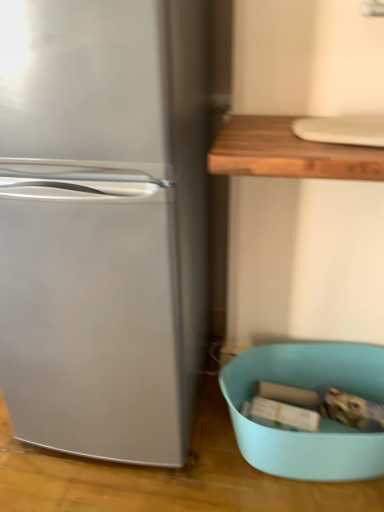
Question: Can you confirm if satin silver refrigerator at left is shorter than teal plastic bowl at lower right?

Choices:
 (A) yes
 (B) no

Answer: (B)

Question: From the image's perspective, is satin silver refrigerator at left below teal plastic bowl at lower right?

Choices:
 (A) no
 (B) yes

Answer: (A)

Question: Is satin silver refrigerator at left positioned far away from teal plastic bowl at lower right?

Choices:
 (A) no
 (B) yes

Answer: (A)

Question: Can you confirm if satin silver refrigerator at left is bigger than teal plastic bowl at lower right?

Choices:
 (A) yes
 (B) no

Answer: (A)

Question: Is satin silver refrigerator at left oriented away from teal plastic bowl at lower right?

Choices:
 (A) yes
 (B) no

Answer: (B)

Question: Can you confirm if satin silver refrigerator at left is smaller than teal plastic bowl at lower right?

Choices:
 (A) yes
 (B) no

Answer: (B)

Question: Is teal plastic bowl at lower right outside satin silver refrigerator at left?

Choices:
 (A) yes
 (B) no

Answer: (A)

Question: Is teal plastic bowl at lower right beside satin silver refrigerator at left?

Choices:
 (A) yes
 (B) no

Answer: (B)

Question: Is teal plastic bowl at lower right further to the viewer compared to satin silver refrigerator at left?

Choices:
 (A) yes
 (B) no

Answer: (A)

Question: Can you confirm if teal plastic bowl at lower right is thinner than satin silver refrigerator at left?

Choices:
 (A) no
 (B) yes

Answer: (B)

Question: Is teal plastic bowl at lower right bigger than satin silver refrigerator at left?

Choices:
 (A) no
 (B) yes

Answer: (A)

Question: Considering the relative sizes of teal plastic bowl at lower right and satin silver refrigerator at left in the image provided, is teal plastic bowl at lower right shorter than satin silver refrigerator at left?

Choices:
 (A) no
 (B) yes

Answer: (B)

Question: Relative to satin silver refrigerator at left, is teal plastic bowl at lower right in front or behind?

Choices:
 (A) front
 (B) behind

Answer: (B)